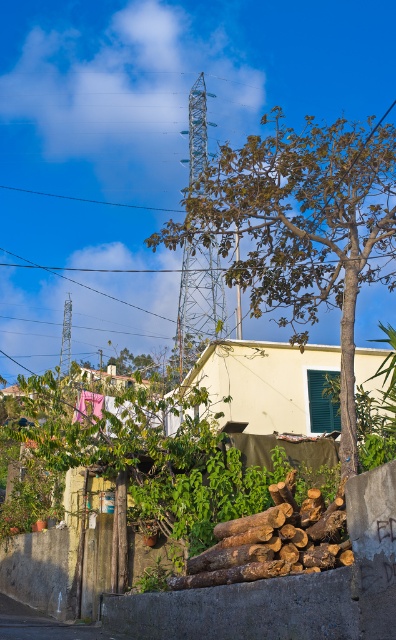
Is point (300, 346) farther from camera compared to point (308, 534)?

Yes, point (300, 346) is farther from viewer.

Who is more forward, (230, 148) or (287, 540)?

Point (287, 540) is more forward.

Between point (279, 198) and point (228, 547), which one is positioned behind?

Point (279, 198)

Locate an element on the screen. This screenshot has width=396, height=640. brown leafy tree at center is located at coordinates tap(302, 227).